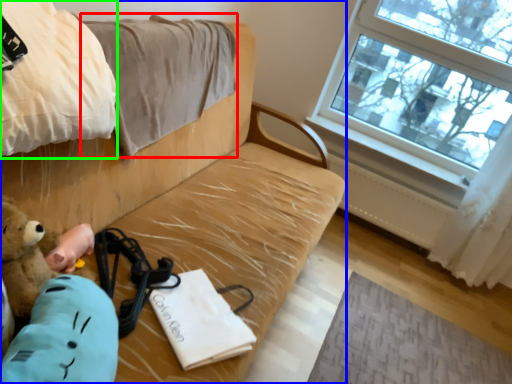
Question: Based on their relative distances, which object is nearer to blanket (highlighted by a red box)? Choose from studio couch (highlighted by a blue box) and blanket (highlighted by a green box).

Choices:
 (A) studio couch
 (B) blanket

Answer: (A)